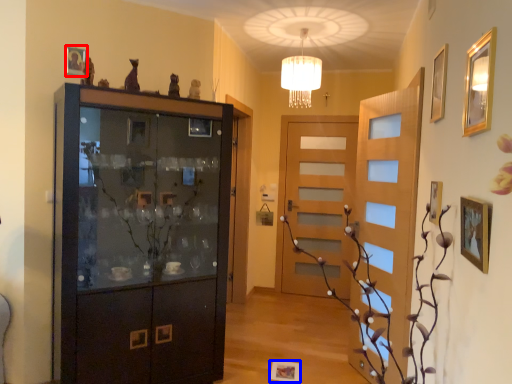
Question: Which of the following is the farthest to the observer, picture frame (highlighted by a red box) or picture frame (highlighted by a blue box)?

Choices:
 (A) picture frame
 (B) picture frame

Answer: (B)